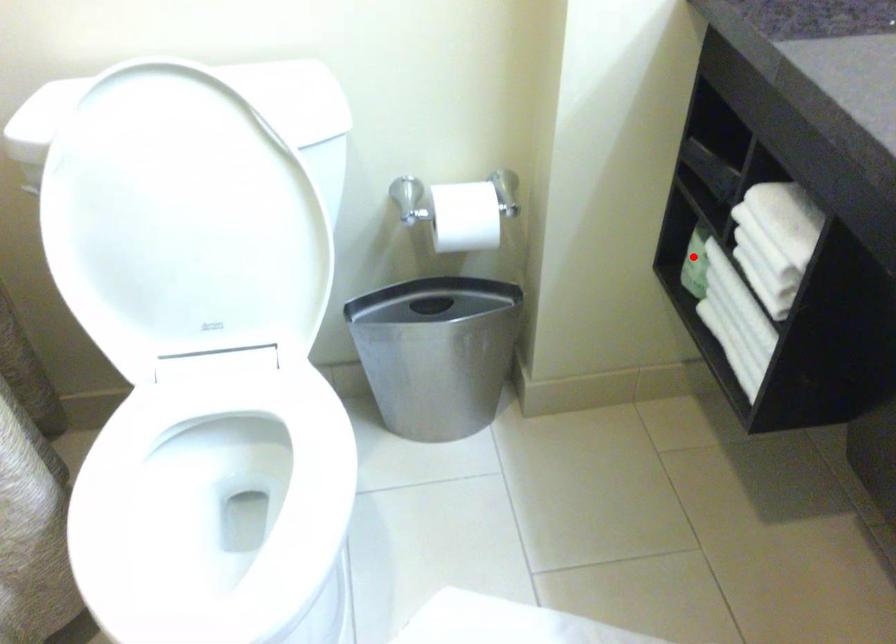
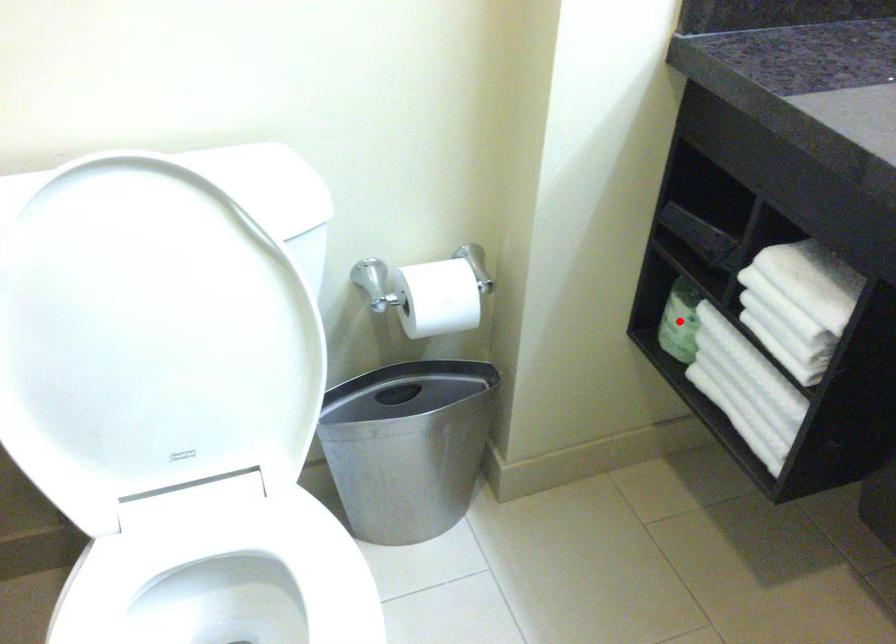
I am providing you with two images of the same scene from different viewpoints. A red point is marked on the first image and another point is marked on the second image. Does the point marked in image1 correspond to the same location as the one in image2?

Yes